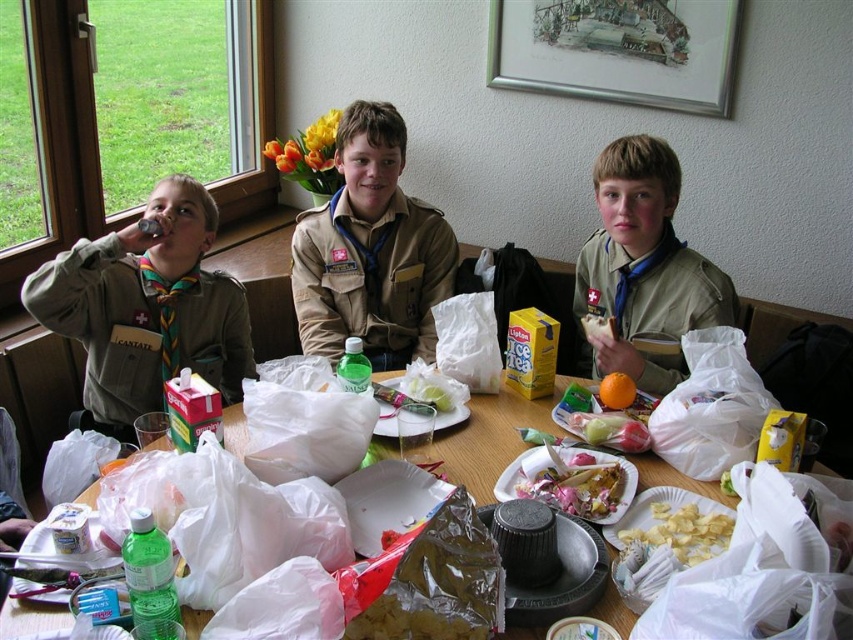
You are a scout leader trying to tidy up the table. You need to move the matte white chips at center to a bowl. Can you place them directly under the matte khaki uniform at center without moving the uniform?

The matte khaki uniform at center is positioned over matte white chips at center, so you cannot place the chips directly under the uniform without moving it first.

You are a scout leader trying to organize the table. You need to place a new item on the table in front of the matte green uniform at left. Where should you place it in relation to the white plastic bags at center?

You should place the new item in front of the matte green uniform at left, which is in front of the white plastic bags at center. This ensures the item is closer to the uniform and not obstructed by the bags.

What are the coordinates of the matte green uniform at left?

The coordinates of the matte green uniform at left are at point (148, 307).